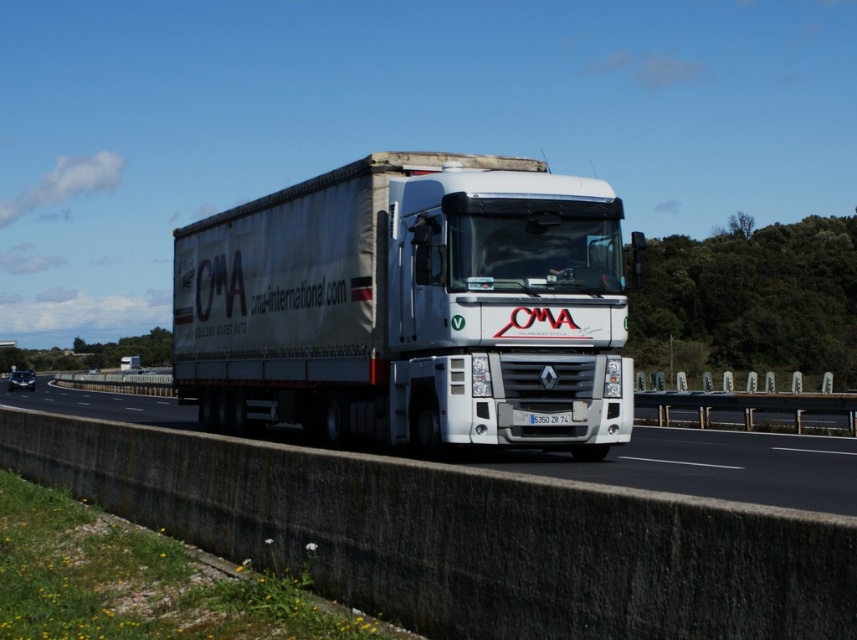
What do you see at coordinates (411, 307) in the screenshot? The image size is (857, 640). I see `white matte trailer truck at center` at bounding box center [411, 307].

Which is more to the left, white matte trailer truck at center or white glossy truck at center?

white glossy truck at center is more to the left.

Describe the element at coordinates (411, 307) in the screenshot. I see `white matte trailer truck at center` at that location.

This screenshot has width=857, height=640. In order to click on white matte trailer truck at center in this screenshot , I will do (411, 307).